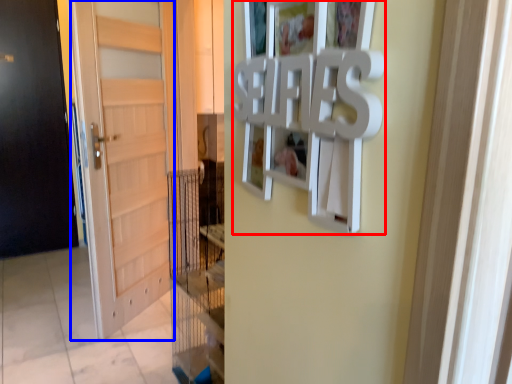
Question: Which object appears closest to the camera in this image, picture frame (highlighted by a red box) or door (highlighted by a blue box)?

Choices:
 (A) picture frame
 (B) door

Answer: (A)